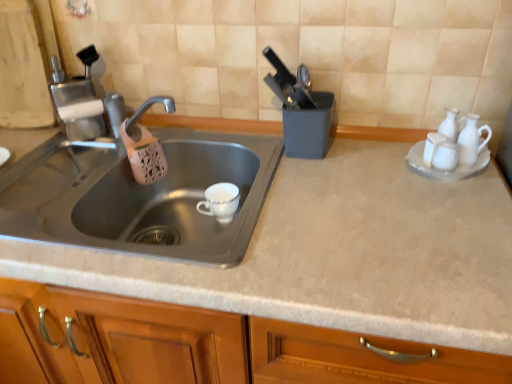
The width and height of the screenshot is (512, 384). Find the location of `free area in between matte plastic knife block at upper right and white ceramic pitcher at right, which ranks as the first tableware in front-to-back order`. free area in between matte plastic knife block at upper right and white ceramic pitcher at right, which ranks as the first tableware in front-to-back order is located at coordinates (366, 154).